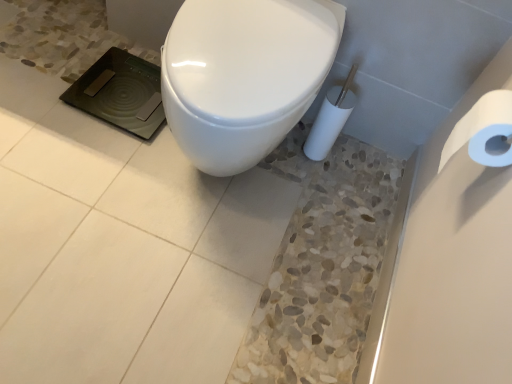
Question: Visually, is white glossy toilet at center positioned to the left or to the right of white paper at right?

Choices:
 (A) left
 (B) right

Answer: (A)

Question: Is white glossy toilet at center bigger or smaller than white paper at right?

Choices:
 (A) big
 (B) small

Answer: (A)

Question: From a real-world perspective, relative to white paper at right, is white glossy toilet at center vertically above or below?

Choices:
 (A) above
 (B) below

Answer: (B)

Question: Is point (504, 94) positioned closer to the camera than point (267, 120)?

Choices:
 (A) closer
 (B) farther

Answer: (A)

Question: In terms of height, does white paper at right look taller or shorter compared to white glossy toilet at center?

Choices:
 (A) tall
 (B) short

Answer: (B)

Question: In terms of size, does white paper at right appear bigger or smaller than white glossy toilet at center?

Choices:
 (A) big
 (B) small

Answer: (B)

Question: Considering their positions, is white paper at right located in front of or behind white glossy toilet at center?

Choices:
 (A) front
 (B) behind

Answer: (A)